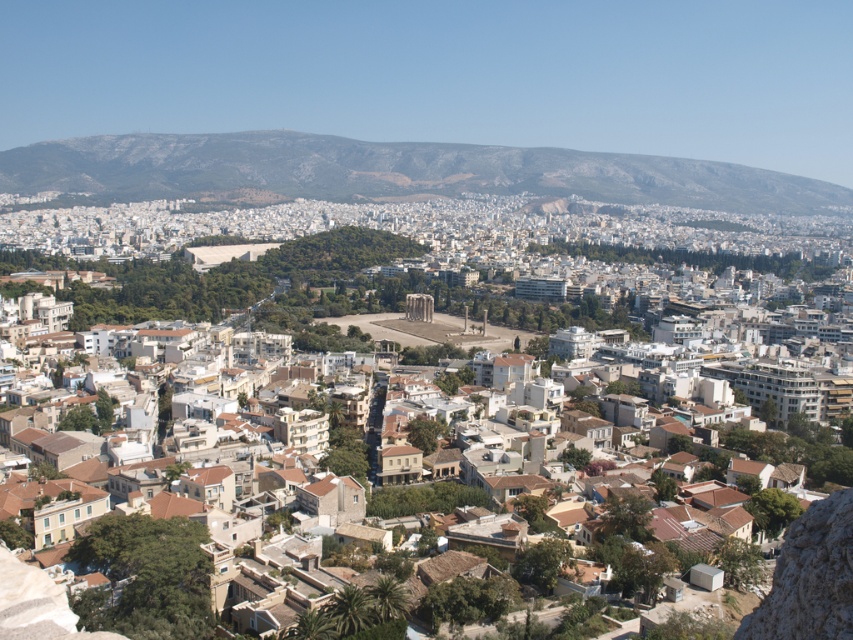
Can you confirm if white stone buildings at center is bigger than gray rocky mountain at upper center?

Yes, white stone buildings at center is bigger than gray rocky mountain at upper center.

Based on the photo, can you confirm if white stone buildings at center is thinner than gray rocky mountain at upper center?

Correct, white stone buildings at center's width is less than gray rocky mountain at upper center's.

Does point (399, 244) lie in front of point (646, 172)?

Yes, point (399, 244) is in front of point (646, 172).

Locate an element on the screen. The height and width of the screenshot is (640, 853). white stone buildings at center is located at coordinates (479, 264).